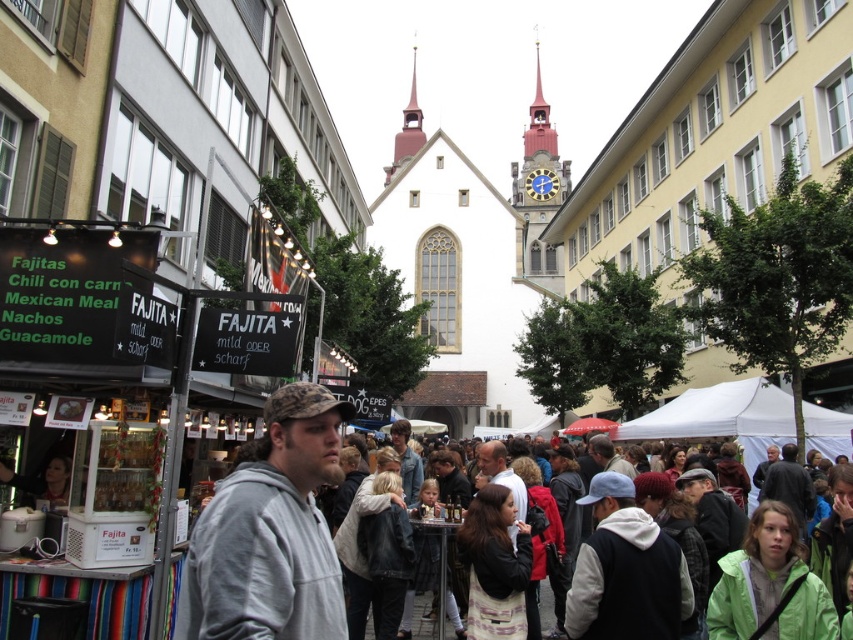
Based on the photo, is white stone church at center to the left of gray matte jacket at center from the viewer's perspective?

In fact, white stone church at center is to the right of gray matte jacket at center.

Is white stone church at center wider than gray matte jacket at center?

Yes.

Is point (405, 216) in front of point (328, 483)?

No, (405, 216) is behind (328, 483).

Locate an element on the screen. The image size is (853, 640). white stone church at center is located at coordinates (471, 266).